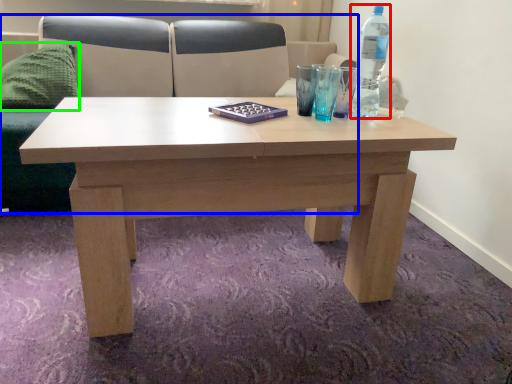
Question: Based on their relative distances, which object is farther from bottle (highlighted by a red box)? Choose from couch (highlighted by a blue box) and pillow (highlighted by a green box).

Choices:
 (A) couch
 (B) pillow

Answer: (B)